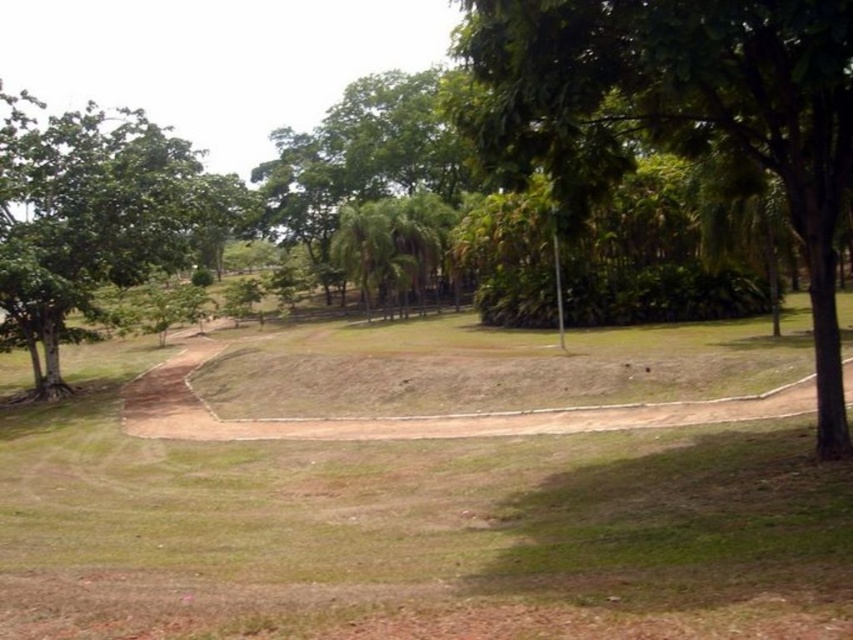
In the scene shown: You are a park visitor trying to find the tallest tree between the green leafy tree at center and the green leafy tree at left. Which one should you head towards?

The green leafy tree at left is taller than the green leafy tree at center, so you should head towards the green leafy tree at left.

You are a gardener planning to plant a new tree in the park. You want to ensure the new tree will have enough space to grow without overcrowding the area. Considering the green leafy tree at center and the green leafy tree at left, which existing tree should you consider for spacing requirements based on their current widths?

The green leafy tree at left has a wider width than the green leafy tree at center, so you should consider the green leafy tree at left for spacing requirements to ensure adequate space for the new tree.

You are standing at the point labeled point (x=809, y=100) and want to walk to the point labeled point (x=82, y=112). Based on their positions, which direction should you head to reach your destination?

Since point (x=809, y=100) is closer to the camera than point (x=82, y=112), you should head away from the camera to reach point (x=82, y=112).